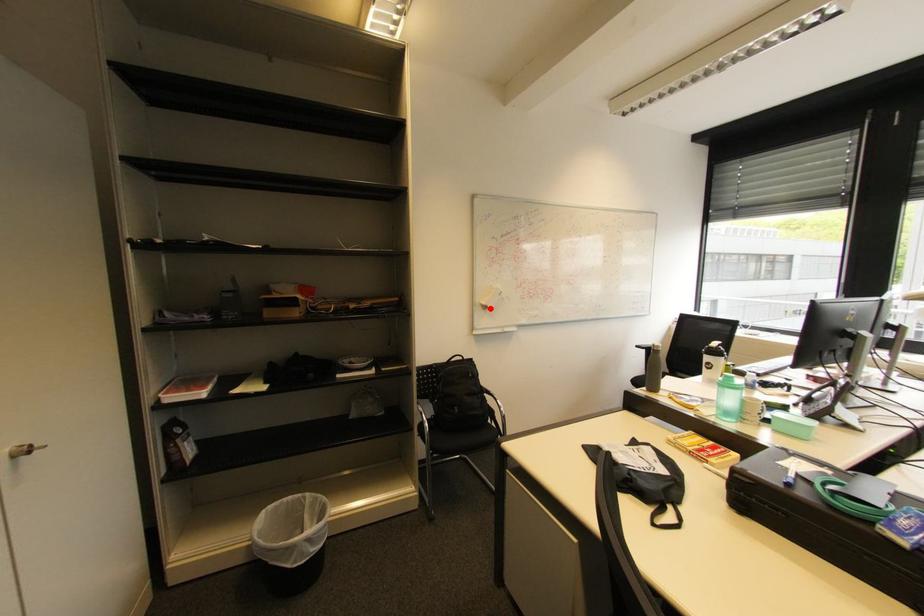
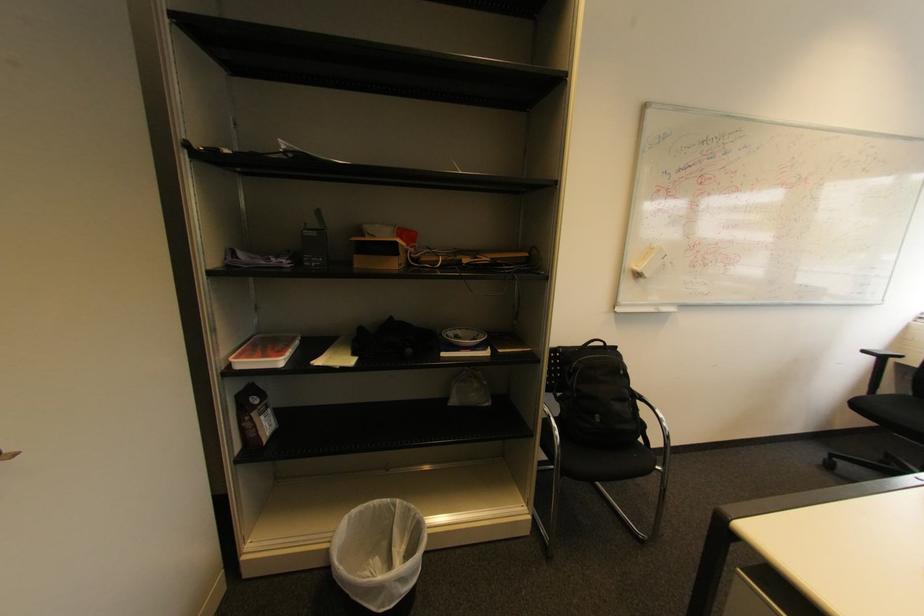
Where in the second image is the point corresponding to the highlighted location from the first image?

(643, 276)